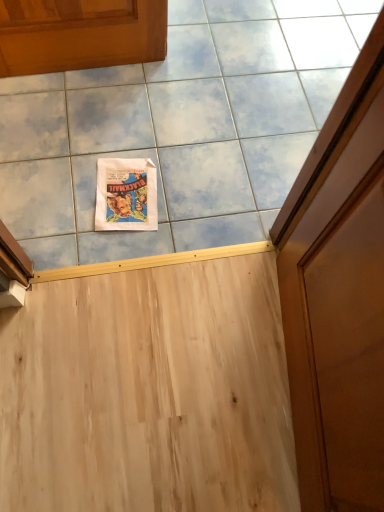
Question: Is matte paper comic book at upper center to the left of white paper poster at upper center from the viewer's perspective?

Choices:
 (A) yes
 (B) no

Answer: (A)

Question: From the image's perspective, is matte paper comic book at upper center below white paper poster at upper center?

Choices:
 (A) no
 (B) yes

Answer: (B)

Question: Is matte paper comic book at upper center oriented towards white paper poster at upper center?

Choices:
 (A) no
 (B) yes

Answer: (A)

Question: From the image's perspective, is matte paper comic book at upper center above white paper poster at upper center?

Choices:
 (A) no
 (B) yes

Answer: (A)

Question: Can you confirm if matte paper comic book at upper center is bigger than white paper poster at upper center?

Choices:
 (A) no
 (B) yes

Answer: (A)

Question: Is matte paper comic book at upper center smaller than white paper poster at upper center?

Choices:
 (A) yes
 (B) no

Answer: (A)

Question: Would you consider white paper poster at upper center to be distant from matte paper comic book at upper center?

Choices:
 (A) no
 (B) yes

Answer: (A)

Question: From a real-world perspective, is white paper poster at upper center located higher than matte paper comic book at upper center?

Choices:
 (A) yes
 (B) no

Answer: (A)

Question: From the image's perspective, would you say white paper poster at upper center is positioned over matte paper comic book at upper center?

Choices:
 (A) no
 (B) yes

Answer: (B)

Question: Is white paper poster at upper center at the right side of matte paper comic book at upper center?

Choices:
 (A) no
 (B) yes

Answer: (B)

Question: Considering the relative sizes of white paper poster at upper center and matte paper comic book at upper center in the image provided, is white paper poster at upper center smaller than matte paper comic book at upper center?

Choices:
 (A) no
 (B) yes

Answer: (A)

Question: From a real-world perspective, is white paper poster at upper center physically below matte paper comic book at upper center?

Choices:
 (A) no
 (B) yes

Answer: (A)

Question: In terms of height, does matte paper comic book at upper center look taller or shorter compared to white paper poster at upper center?

Choices:
 (A) short
 (B) tall

Answer: (B)